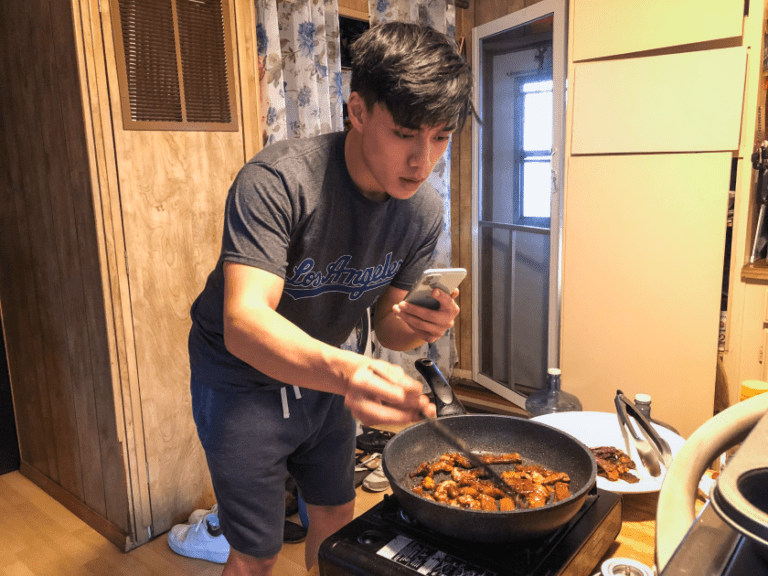
Find the location of `stove`. stove is located at coordinates (384, 553).